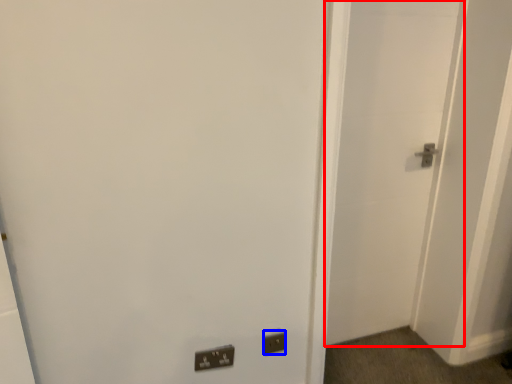
Question: Which point is closer to the camera, door (highlighted by a red box) or electric outlet (highlighted by a blue box)?

Choices:
 (A) door
 (B) electric outlet

Answer: (A)